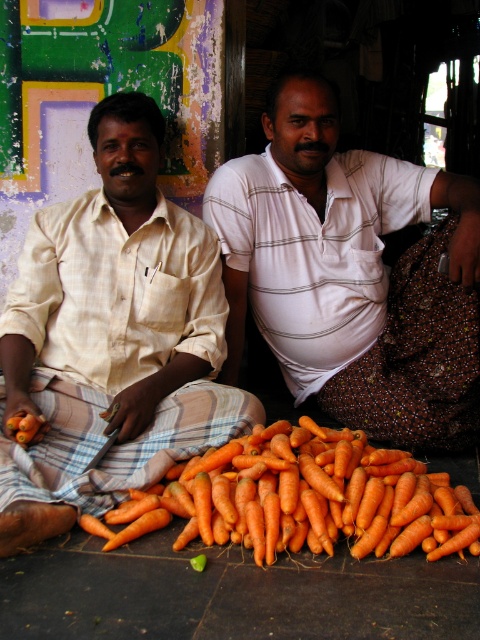
You are a photographer trying to capture the light beige fabric shirt at left and the white polo shirt with horizontal stripes at right in the same frame. Based on their positions, which shirt is closer to the camera?

The light beige fabric shirt at left is located at point (111, 337), so it is closer to the camera than the white polo shirt with horizontal stripes at right.

You are a photographer trying to capture a photo of the white striped shirt at center and the brown textured cloth at lower right. Based on their positions, which object would appear larger in the photo?

The white striped shirt at center would appear larger in the photo because it is much taller than the brown textured cloth at lower right.